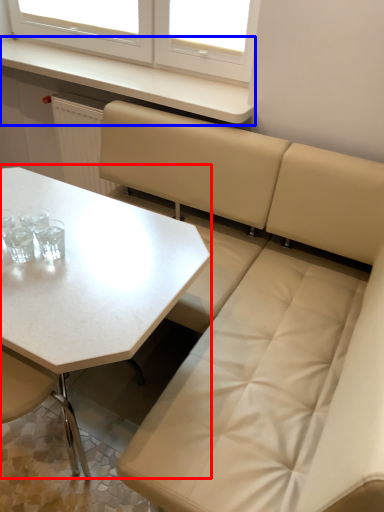
Question: Which object appears closest to the camera in this image, table (highlighted by a red box) or counter top (highlighted by a blue box)?

Choices:
 (A) table
 (B) counter top

Answer: (A)